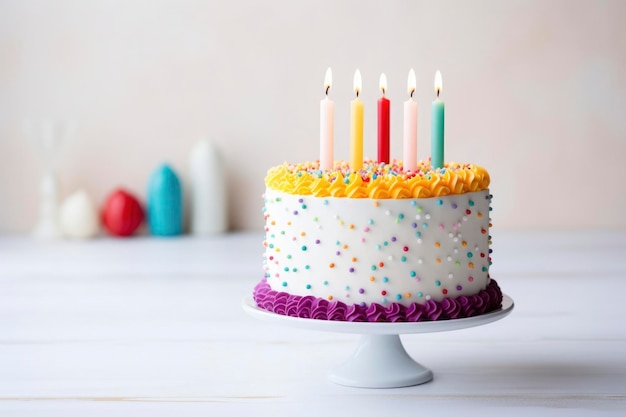
The height and width of the screenshot is (417, 626). Find the location of `candle`. candle is located at coordinates (359, 148), (382, 132), (327, 126), (411, 126), (437, 119).